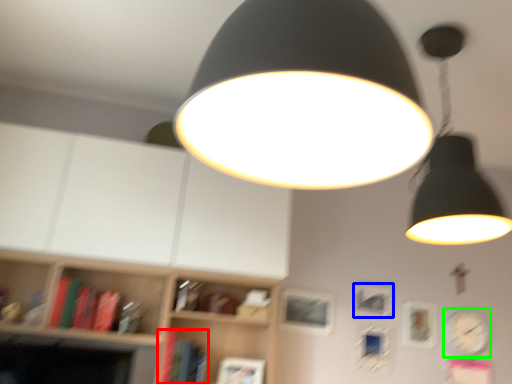
Question: Based on their relative distances, which object is nearer to book (highlighted by a red box)? Choose from picture frame (highlighted by a blue box) and clock (highlighted by a green box).

Choices:
 (A) picture frame
 (B) clock

Answer: (A)